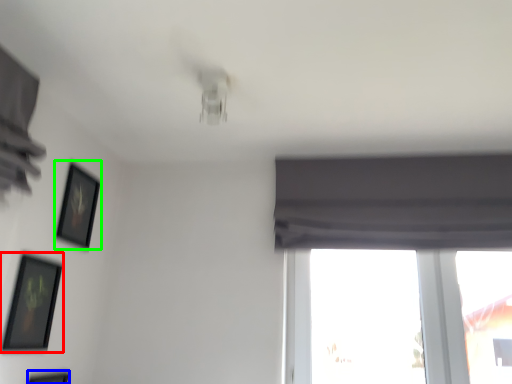
Question: Which object is positioned farthest from picture frame (highlighted by a red box)? Select from picture frame (highlighted by a blue box) and picture frame (highlighted by a green box).

Choices:
 (A) picture frame
 (B) picture frame

Answer: (B)